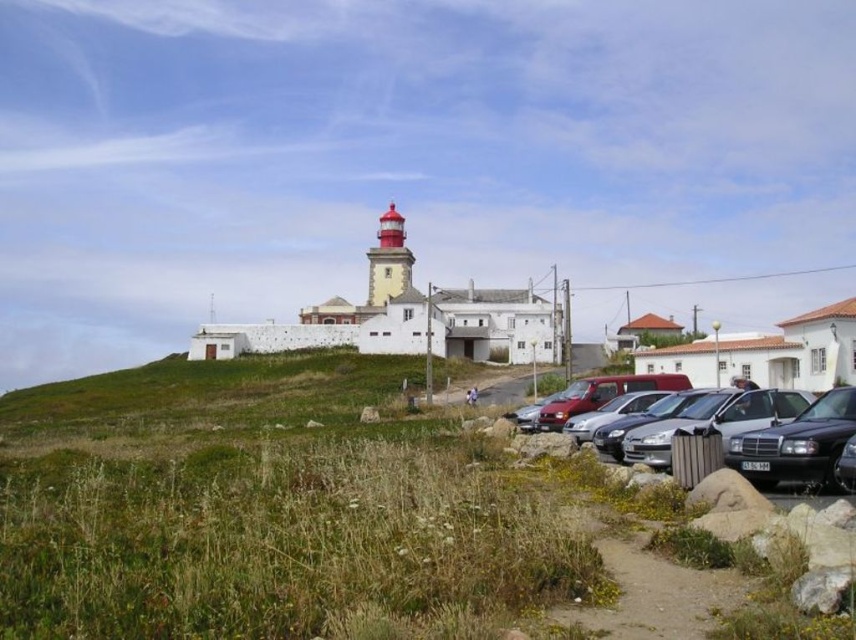
Does green grass at lower left come behind smooth yellow lighthouse at center?

No, green grass at lower left is closer to the viewer.

Who is more forward, (302, 424) or (395, 216)?

Point (302, 424) is in front.

Describe the element at coordinates (278, 508) in the screenshot. Image resolution: width=856 pixels, height=640 pixels. I see `green grass at lower left` at that location.

You are a GUI agent. You are given a task and a screenshot of the screen. Output one action in this format:
    pyautogui.click(x=<x>, y=<y>)
    Task: Click on the green grass at lower left
    This screenshot has width=856, height=640.
    Given the screenshot: What is the action you would take?
    pyautogui.click(x=278, y=508)

Is green grass at lower left behind metallic silver car at center?

No, it is not.

Between green grass at lower left and metallic silver car at center, which one is positioned lower?

green grass at lower left is lower down.

Locate an element on the screen. The image size is (856, 640). green grass at lower left is located at coordinates (278, 508).

Is metallic silver car at center behind shiny black sedan at lower right?

No, metallic silver car at center is closer to the viewer.

Between metallic silver car at center and shiny black sedan at lower right, which one is positioned higher?

Positioned higher is metallic silver car at center.

This screenshot has height=640, width=856. What are the coordinates of `metallic silver car at center` in the screenshot? It's located at (764, 435).